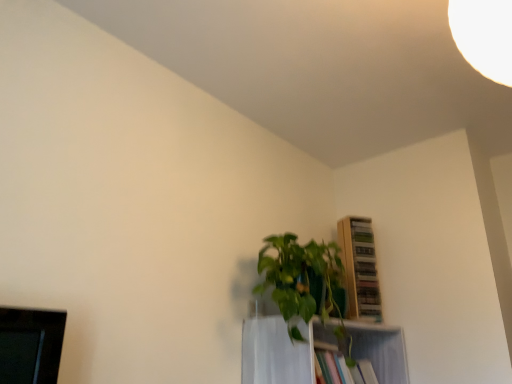
Question: Is wooden shelf at upper right, the 2th shelf ordered from the bottom, smaller than green leafy plant at center?

Choices:
 (A) no
 (B) yes

Answer: (B)

Question: Considering the relative sizes of wooden shelf at upper right, which ranks as the 1th shelf in top-to-bottom order, and green leafy plant at center in the image provided, is wooden shelf at upper right, which ranks as the 1th shelf in top-to-bottom order, shorter than green leafy plant at center?

Choices:
 (A) yes
 (B) no

Answer: (B)

Question: Does wooden shelf at upper right, which ranks as the 1th shelf in top-to-bottom order, touch green leafy plant at center?

Choices:
 (A) no
 (B) yes

Answer: (A)

Question: Does wooden shelf at upper right, which ranks as the 1th shelf in top-to-bottom order, have a greater width compared to green leafy plant at center?

Choices:
 (A) no
 (B) yes

Answer: (A)

Question: Is wooden shelf at upper right, which ranks as the 1th shelf in top-to-bottom order, positioned behind green leafy plant at center?

Choices:
 (A) yes
 (B) no

Answer: (A)

Question: In the image, is wooden shelf at upper right, the 2th shelf ordered from the bottom, positioned in front of or behind green leafy plant at center?

Choices:
 (A) front
 (B) behind

Answer: (B)

Question: From the image's perspective, relative to green leafy plant at center, is wooden shelf at upper right, which ranks as the 1th shelf in top-to-bottom order, above or below?

Choices:
 (A) above
 (B) below

Answer: (B)

Question: Looking at the image, does wooden shelf at upper right, which ranks as the 1th shelf in top-to-bottom order, seem bigger or smaller compared to green leafy plant at center?

Choices:
 (A) small
 (B) big

Answer: (A)

Question: From a real-world perspective, is wooden shelf at upper right, which ranks as the 1th shelf in top-to-bottom order, physically located above or below green leafy plant at center?

Choices:
 (A) above
 (B) below

Answer: (A)

Question: In the image, is white glossy shelf at center, placed as the first shelf when sorted from bottom to top, on the left side or the right side of green leafy plant at center?

Choices:
 (A) left
 (B) right

Answer: (B)

Question: In terms of height, does white glossy shelf at center, placed as the first shelf when sorted from bottom to top, look taller or shorter compared to green leafy plant at center?

Choices:
 (A) short
 (B) tall

Answer: (A)

Question: Considering the positions of white glossy shelf at center, which is counted as the second shelf, starting from the top, and green leafy plant at center in the image, is white glossy shelf at center, which is counted as the second shelf, starting from the top, wider or thinner than green leafy plant at center?

Choices:
 (A) wide
 (B) thin

Answer: (B)

Question: Considering the positions of point (399, 364) and point (343, 291), is point (399, 364) closer or farther from the camera than point (343, 291)?

Choices:
 (A) farther
 (B) closer

Answer: (A)

Question: From the image's perspective, is white glossy shelf at center, which is counted as the second shelf, starting from the top, positioned above or below wooden shelf at upper right, the 2th shelf ordered from the bottom?

Choices:
 (A) below
 (B) above

Answer: (A)

Question: Would you say white glossy shelf at center, which is counted as the second shelf, starting from the top, is to the left or to the right of wooden shelf at upper right, the 2th shelf ordered from the bottom, in the picture?

Choices:
 (A) left
 (B) right

Answer: (A)